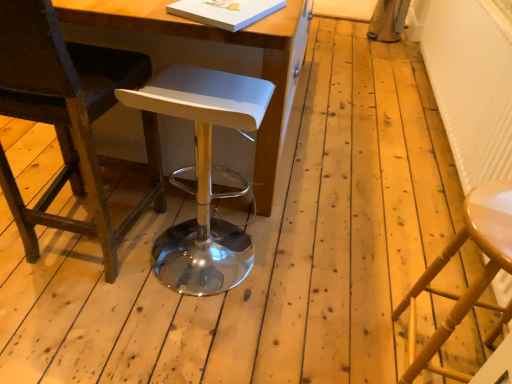
Locate an element on the screen. The width and height of the screenshot is (512, 384). white plastic stool at center, acting as the second stool starting from the right is located at coordinates pos(203,174).

This screenshot has height=384, width=512. What do you see at coordinates (472, 84) in the screenshot?
I see `white textured radiator at right` at bounding box center [472, 84].

Find the location of a particular element. This screenshot has height=384, width=512. white plastic stool at center, marked as the first stool in a left-to-right arrangement is located at coordinates (203, 174).

From a real-world perspective, is dark brown leather chair at left located higher than wooden chair at right, the first stool when ordered from right to left?

Indeed, from a real-world perspective, dark brown leather chair at left stands above wooden chair at right, the first stool when ordered from right to left.

Between dark brown leather chair at left and wooden chair at right, the first stool when ordered from right to left, which one has more height?

dark brown leather chair at left is taller.

I want to click on chair located behind the wooden chair at right, positioned as the second stool in left-to-right order, so click(x=69, y=119).

From the picture: Considering the relative sizes of dark brown leather chair at left and white textured radiator at right in the image provided, is dark brown leather chair at left taller than white textured radiator at right?

Yes, dark brown leather chair at left is taller than white textured radiator at right.

From a real-world perspective, between dark brown leather chair at left and white textured radiator at right, who is vertically higher?

dark brown leather chair at left is physically above.

Looking at this image, in the image, is dark brown leather chair at left positioned in front of or behind white textured radiator at right?

Clearly, dark brown leather chair at left is in front of white textured radiator at right.

How different are the orientations of dark brown leather chair at left and white textured radiator at right in degrees?

The angular difference between dark brown leather chair at left and white textured radiator at right is 86.6 degrees.

How distant is wooden table at center from wooden chair at right, positioned as the second stool in left-to-right order?

A distance of 33.48 inches exists between wooden table at center and wooden chair at right, positioned as the second stool in left-to-right order.

Would you say wooden table at center is to the left or to the right of wooden chair at right, the first stool when ordered from right to left, in the picture?

wooden table at center is to the left of wooden chair at right, the first stool when ordered from right to left.

Locate an element on the screen. The image size is (512, 384). table behind the wooden chair at right, the first stool when ordered from right to left is located at coordinates (207, 56).

Is wooden table at center oriented away from wooden chair at right, positioned as the second stool in left-to-right order?

That's right, wooden table at center is facing away from wooden chair at right, positioned as the second stool in left-to-right order.

Considering the sizes of white textured radiator at right and white plastic stool at center, acting as the second stool starting from the right, in the image, is white textured radiator at right bigger or smaller than white plastic stool at center, acting as the second stool starting from the right,?

white textured radiator at right is bigger than white plastic stool at center, acting as the second stool starting from the right.

Are white textured radiator at right and white plastic stool at center, marked as the first stool in a left-to-right arrangement, far apart?

Yes, white textured radiator at right is far from white plastic stool at center, marked as the first stool in a left-to-right arrangement.

Is wooden chair at right, the first stool when ordered from right to left, facing towards wooden table at center?

No.

From a real-world perspective, between wooden chair at right, the first stool when ordered from right to left, and wooden table at center, who is vertically higher?

wooden table at center, from a real-world perspective.

Is wooden chair at right, positioned as the second stool in left-to-right order, to the right of wooden table at center from the viewer's perspective?

Yes, wooden chair at right, positioned as the second stool in left-to-right order, is to the right of wooden table at center.

In terms of size, does wooden chair at right, positioned as the second stool in left-to-right order, appear bigger or smaller than wooden table at center?

wooden chair at right, positioned as the second stool in left-to-right order, is smaller than wooden table at center.

Is white textured radiator at right not close to wooden table at center?

Yes, white textured radiator at right and wooden table at center are located far from each other.

Which of these two, white textured radiator at right or wooden table at center, is thinner?

Thinner between the two is white textured radiator at right.

Consider the image. Does white textured radiator at right have a lesser height compared to wooden table at center?

Yes, white textured radiator at right is shorter than wooden table at center.

Is white textured radiator at right at the left side of wooden table at center?

In fact, white textured radiator at right is to the right of wooden table at center.

From the image's perspective, is white textured radiator at right below dark brown leather chair at left?

No, from the image's perspective, white textured radiator at right is not beneath dark brown leather chair at left.

Between white textured radiator at right and dark brown leather chair at left, which one has more height?

dark brown leather chair at left.

Between white textured radiator at right and dark brown leather chair at left, which one has smaller size?

white textured radiator at right is smaller.

Identify the location of chair that is behind the wooden chair at right, the first stool when ordered from right to left. Image resolution: width=512 pixels, height=384 pixels. (69, 119).

This screenshot has height=384, width=512. Identify the location of chair below the white textured radiator at right (from the image's perspective). (69, 119).

When comparing their distances from dark brown leather chair at left, does white plastic stool at center, acting as the second stool starting from the right, or wooden table at center seem further?

white plastic stool at center, acting as the second stool starting from the right, is positioned further to the anchor dark brown leather chair at left.

Considering their positions, is wooden table at center positioned further to dark brown leather chair at left than white textured radiator at right?

Among the two, white textured radiator at right is located further to dark brown leather chair at left.

Considering their positions, is wooden chair at right, the first stool when ordered from right to left, positioned closer to wooden table at center than white textured radiator at right?

Based on the image, wooden chair at right, the first stool when ordered from right to left, appears to be nearer to wooden table at center.

From the image, which object appears to be nearer to white textured radiator at right, white plastic stool at center, acting as the second stool starting from the right, or wooden chair at right, positioned as the second stool in left-to-right order?

The object closer to white textured radiator at right is wooden chair at right, positioned as the second stool in left-to-right order.

Estimate the real-world distances between objects in this image. Which object is further from white plastic stool at center, acting as the second stool starting from the right, wooden table at center or dark brown leather chair at left?

dark brown leather chair at left is further to white plastic stool at center, acting as the second stool starting from the right.

Based on their spatial positions, is white plastic stool at center, marked as the first stool in a left-to-right arrangement, or white textured radiator at right further from wooden chair at right, positioned as the second stool in left-to-right order?

Among the two, white textured radiator at right is located further to wooden chair at right, positioned as the second stool in left-to-right order.

From the image, which object appears to be nearer to wooden chair at right, the first stool when ordered from right to left, dark brown leather chair at left or white plastic stool at center, marked as the first stool in a left-to-right arrangement?

Based on the image, white plastic stool at center, marked as the first stool in a left-to-right arrangement, appears to be nearer to wooden chair at right, the first stool when ordered from right to left.

Based on their spatial positions, is wooden chair at right, positioned as the second stool in left-to-right order, or white plastic stool at center, acting as the second stool starting from the right, closer to wooden table at center?

white plastic stool at center, acting as the second stool starting from the right, is positioned closer to the anchor wooden table at center.

You are a GUI agent. You are given a task and a screenshot of the screen. Output one action in this format:
    pyautogui.click(x=<x>, y=<y>)
    Task: Click on the stool between wooden table at center and wooden chair at right, the first stool when ordered from right to left, from top to bottom
    This screenshot has height=384, width=512.
    Given the screenshot: What is the action you would take?
    pyautogui.click(x=203, y=174)

At what (x,y) coordinates should I click in order to perform the action: click on table between dark brown leather chair at left and white textured radiator at right in the horizontal direction. Please return your answer as a coordinate pair (x, y). Image resolution: width=512 pixels, height=384 pixels. Looking at the image, I should click on (207, 56).

This screenshot has width=512, height=384. What are the coordinates of `stool between white plastic stool at center, acting as the second stool starting from the right, and white textured radiator at right` in the screenshot? It's located at (474, 281).

Identify the location of table between dark brown leather chair at left and wooden chair at right, the first stool when ordered from right to left, in the horizontal direction. (207, 56).